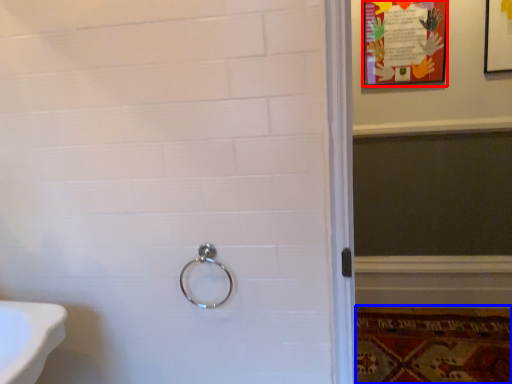
Question: Which of the following is the farthest to the observer, poster page (highlighted by a red box) or mat (highlighted by a blue box)?

Choices:
 (A) poster page
 (B) mat

Answer: (A)